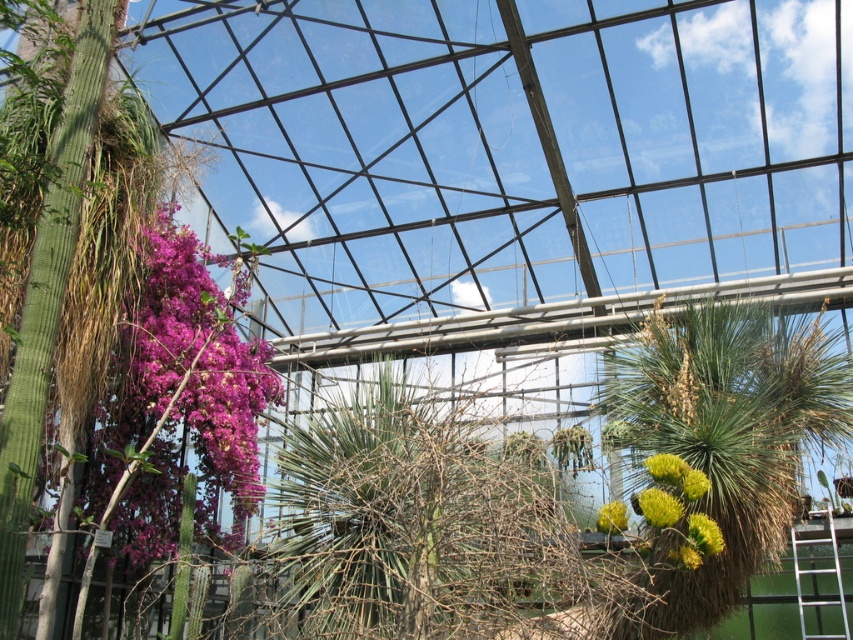
Does purple matte flowers at left have a larger size compared to yellow fuzzy flower at center?

Indeed, purple matte flowers at left has a larger size compared to yellow fuzzy flower at center.

Which is more to the left, purple matte flowers at left or yellow fuzzy flower at center?

Positioned to the left is purple matte flowers at left.

Is point (160, 378) farther from camera compared to point (612, 508)?

That is True.

Locate an element on the screen. The height and width of the screenshot is (640, 853). purple matte flowers at left is located at coordinates (184, 372).